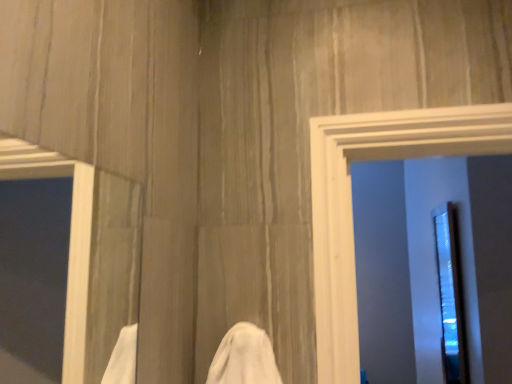
Question: Is white matte frame at left bigger or smaller than transparent plastic screen door at right?

Choices:
 (A) big
 (B) small

Answer: (B)

Question: Is white matte frame at left wider or thinner than transparent plastic screen door at right?

Choices:
 (A) wide
 (B) thin

Answer: (B)

Question: Based on their positions, is white matte frame at left located to the left or right of transparent plastic screen door at right?

Choices:
 (A) right
 (B) left

Answer: (B)

Question: From the image's perspective, is transparent plastic screen door at right above or below white matte frame at left?

Choices:
 (A) above
 (B) below

Answer: (B)

Question: In terms of size, does transparent plastic screen door at right appear bigger or smaller than white matte frame at left?

Choices:
 (A) big
 (B) small

Answer: (A)

Question: Is transparent plastic screen door at right wider or thinner than white matte frame at left?

Choices:
 (A) thin
 (B) wide

Answer: (B)

Question: From their relative heights in the image, would you say transparent plastic screen door at right is taller or shorter than white matte frame at left?

Choices:
 (A) tall
 (B) short

Answer: (A)